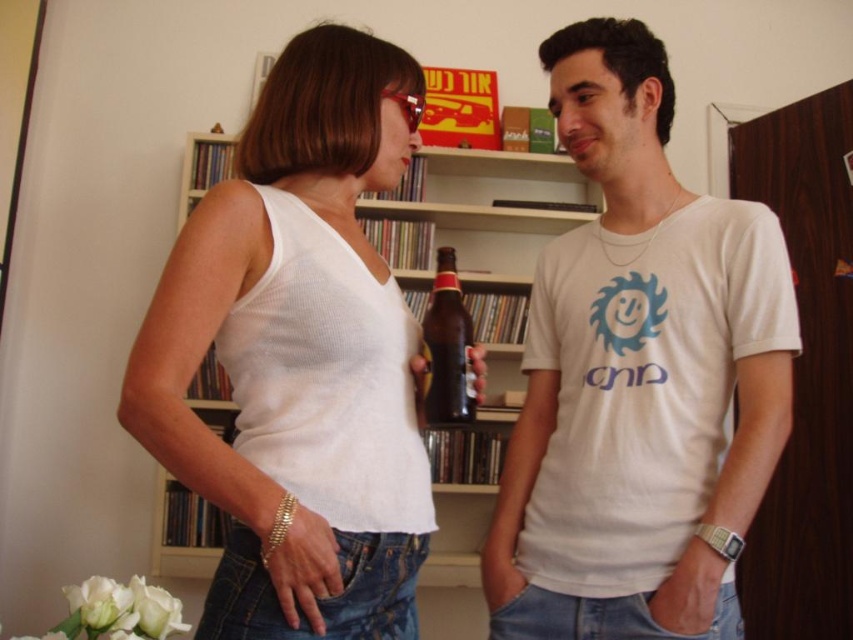
Question: Does white cotton t-shirt at center appear under white ribbed tank top at center?

Choices:
 (A) no
 (B) yes

Answer: (B)

Question: Is white cotton t-shirt at center further to the viewer compared to white ribbed tank top at center?

Choices:
 (A) yes
 (B) no

Answer: (A)

Question: Which of these objects is positioned farthest from the brown glass bottle at center?

Choices:
 (A) white cotton t-shirt at center
 (B) white ribbed tank top at center

Answer: (A)

Question: Does white ribbed tank top at center come in front of brown glass bottle at center?

Choices:
 (A) yes
 (B) no

Answer: (A)

Question: Which of the following is the farthest from the observer?

Choices:
 (A) white cotton t-shirt at center
 (B) brown glass bottle at center

Answer: (B)

Question: Which point is farther to the camera?

Choices:
 (A) (552, 317)
 (B) (338, 561)
 (C) (447, 266)

Answer: (A)